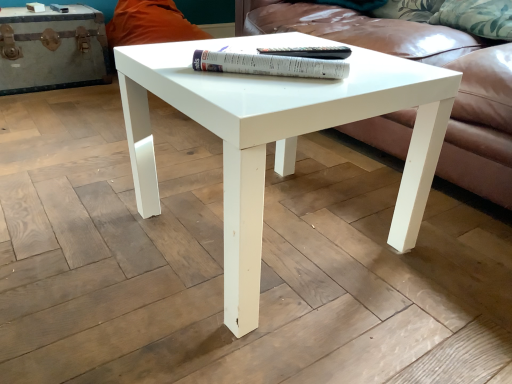
Where is `free space behind white glossy coffee table at center`? free space behind white glossy coffee table at center is located at coordinates (266, 167).